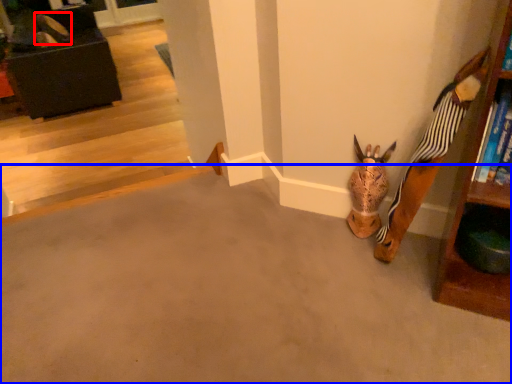
Question: Which object appears farthest to the camera in this image, shoe (highlighted by a red box) or concrete (highlighted by a blue box)?

Choices:
 (A) shoe
 (B) concrete

Answer: (A)